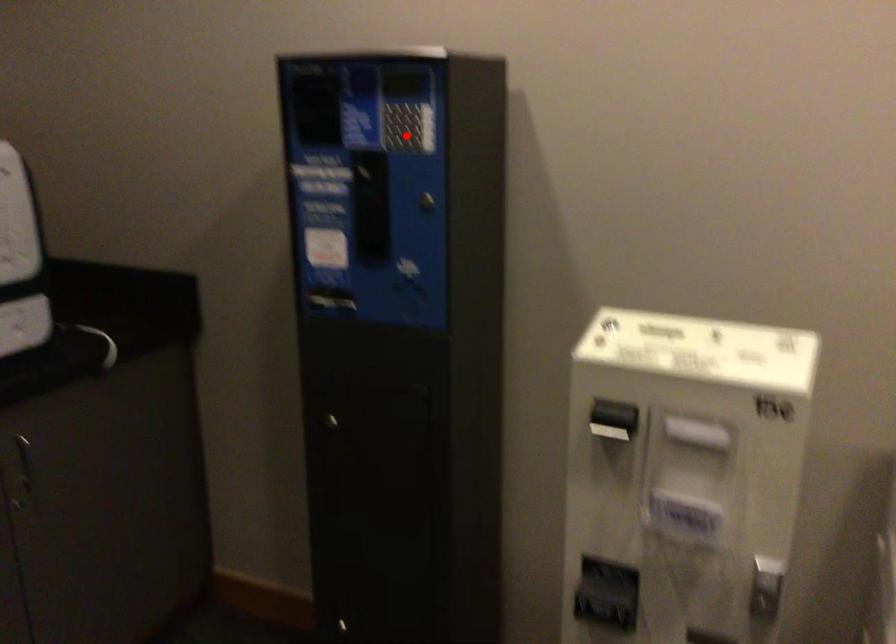
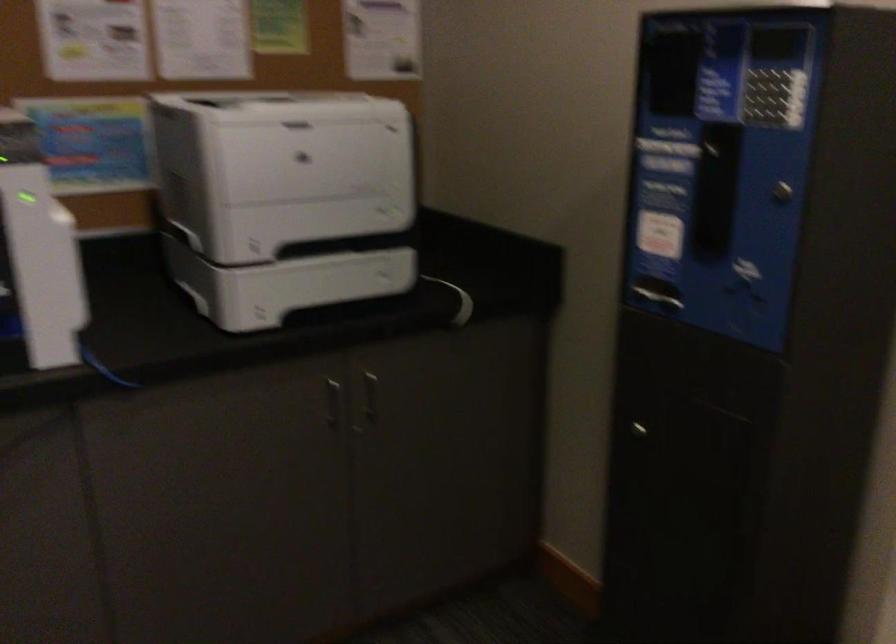
Question: A red point is marked in image1. In image2, is the corresponding 3D point closer to the camera or farther? Reply with the corresponding letter.

Choices:
 (A) The corresponding 3D point is closer.
 (B) The corresponding 3D point is farther.

Answer: (A)